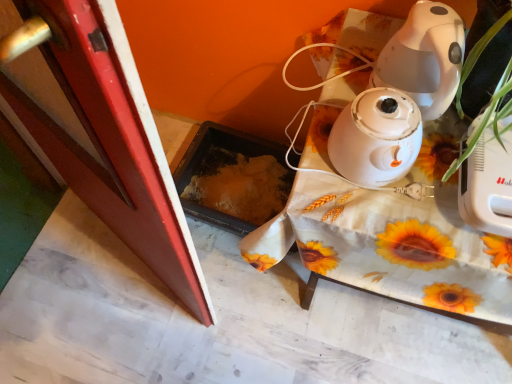
At what (x,y) coordinates should I click in order to perform the action: click on free location to the left of white glossy humidifier at center. Please return your answer as a coordinate pair (x, y). Looking at the image, I should click on click(310, 164).